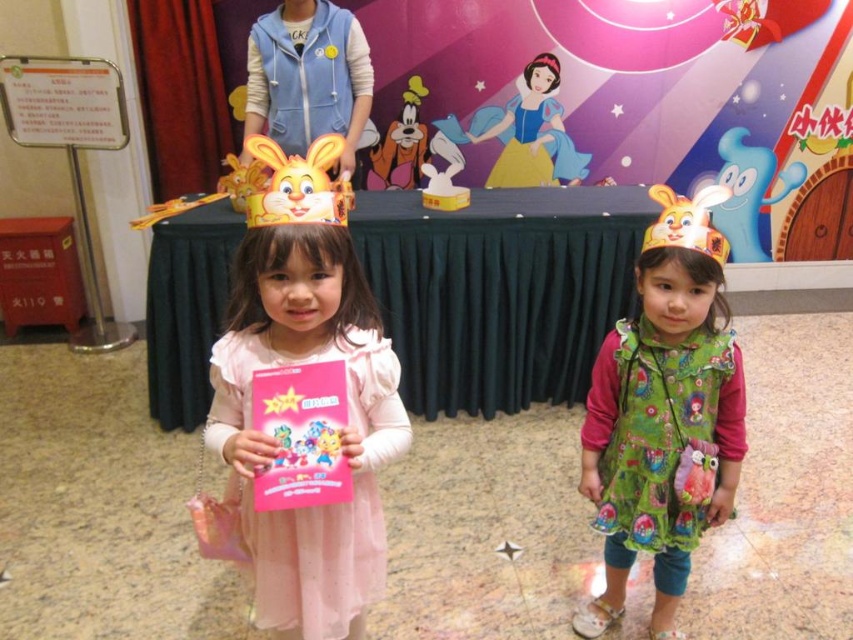
Can you confirm if matte green dress at center is wider than matte yellow paper crown at upper right?

Indeed, matte green dress at center has a greater width compared to matte yellow paper crown at upper right.

Which is below, matte green dress at center or matte yellow paper crown at upper right?

matte green dress at center is below.

Does point (657, 472) lie behind point (699, 204)?

Yes.

Where is `matte green dress at center`? matte green dress at center is located at coordinates (664, 413).

Does matte green dress at center have a lesser width compared to pink satin dress at center?

Correct, matte green dress at center's width is less than pink satin dress at center's.

Is point (706, 272) positioned behind point (228, 353)?

That is True.

Is point (691, 420) farther from camera compared to point (311, 541)?

Yes.

The width and height of the screenshot is (853, 640). I want to click on matte green dress at center, so click(x=664, y=413).

Who is higher up, pink satin dress at center or yellow paper bunny at center?

yellow paper bunny at center

The height and width of the screenshot is (640, 853). Describe the element at coordinates (320, 506) in the screenshot. I see `pink satin dress at center` at that location.

Where is `pink satin dress at center`? The width and height of the screenshot is (853, 640). pink satin dress at center is located at coordinates (320, 506).